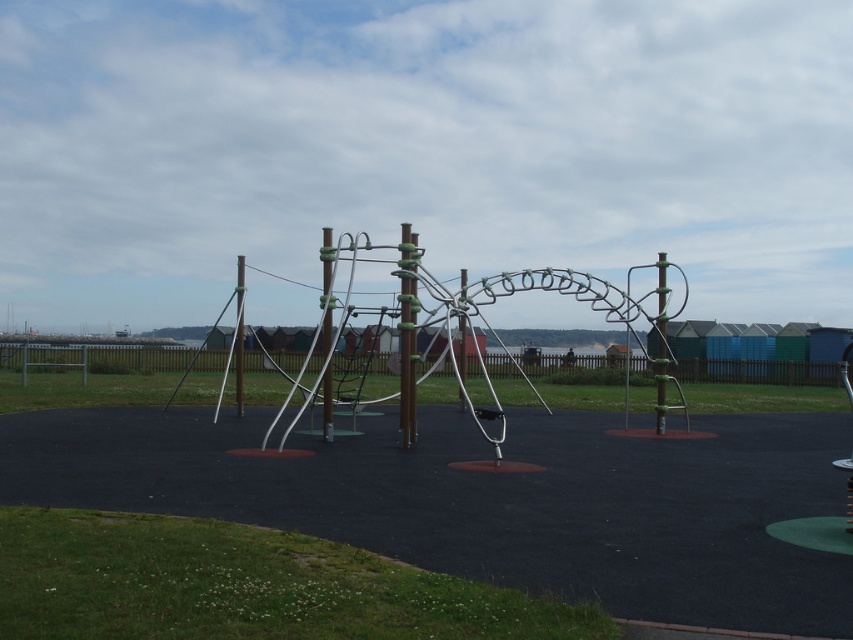
You are a parent trying to guide your child to the metallic silver playground equipment at center. Your child is currently standing next to the green rubber pole at center. Which direction should they move to reach the equipment?

The metallic silver playground equipment at center is positioned on the right side of the green rubber pole at center, so your child should move to the right to reach it.